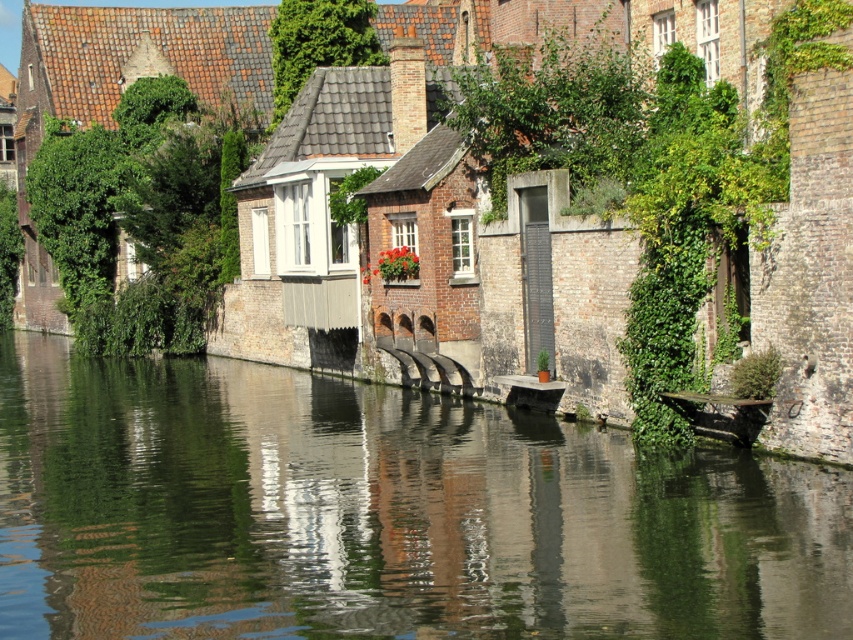
Question: Does smooth concrete water at center come in front of wooden boat at center?

Choices:
 (A) yes
 (B) no

Answer: (A)

Question: Among these points, which one is nearest to the camera?

Choices:
 (A) (1, 616)
 (B) (711, 400)

Answer: (A)

Question: Among these points, which one is farthest from the camera?

Choices:
 (A) (173, 572)
 (B) (700, 394)

Answer: (B)

Question: Can you confirm if smooth concrete water at center is thinner than wooden boat at center?

Choices:
 (A) no
 (B) yes

Answer: (A)

Question: Is smooth concrete water at center behind wooden boat at center?

Choices:
 (A) yes
 (B) no

Answer: (B)